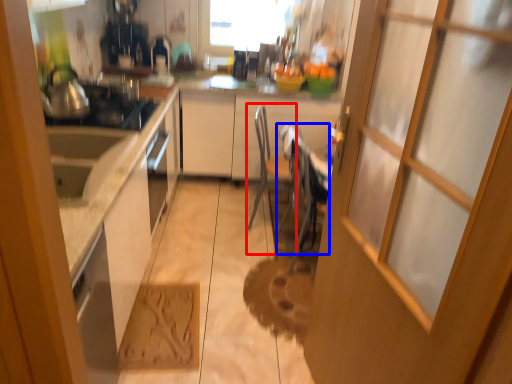
Question: Which object is closer to the camera taking this photo, chair (highlighted by a red box) or chair (highlighted by a blue box)?

Choices:
 (A) chair
 (B) chair

Answer: (B)